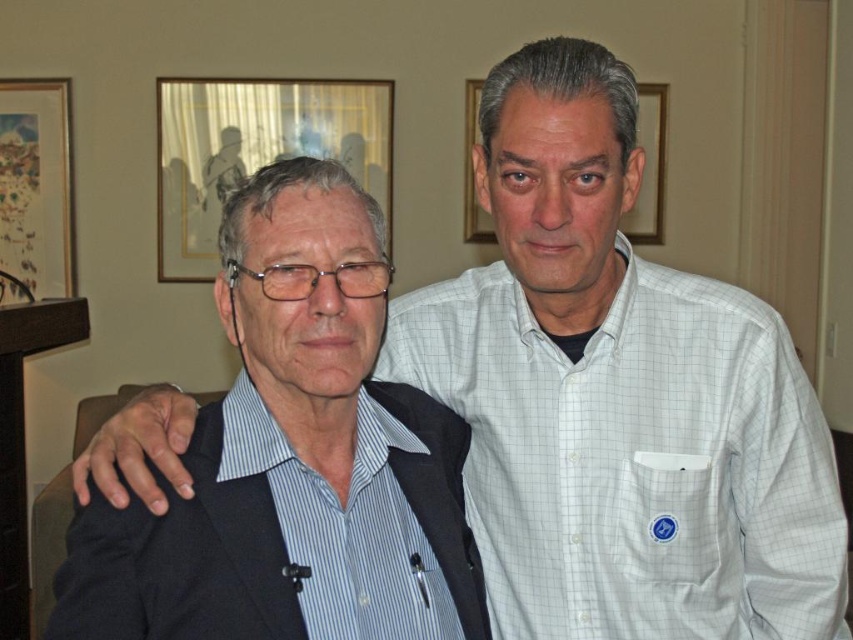
Question: In this image, where is blue striped shirt at left located relative to matte wood picture frame at center?

Choices:
 (A) above
 (B) below

Answer: (B)

Question: Which object appears closest to the camera in this image?

Choices:
 (A) matte paper picture frame at upper left
 (B) matte wood picture frame at center
 (C) matte glass picture frame at upper center
 (D) blue striped shirt at left

Answer: (D)

Question: Is matte glass picture frame at upper center further to camera compared to matte paper picture frame at upper left?

Choices:
 (A) no
 (B) yes

Answer: (A)

Question: Which point is closer to the camera?

Choices:
 (A) (9, 204)
 (B) (335, 572)
 (C) (651, 122)
 (D) (180, 220)

Answer: (B)

Question: From the image, what is the correct spatial relationship of blue striped shirt at left in relation to matte paper picture frame at upper left?

Choices:
 (A) below
 (B) above

Answer: (A)

Question: Which object appears closest to the camera in this image?

Choices:
 (A) matte wood picture frame at center
 (B) matte glass picture frame at upper center

Answer: (B)